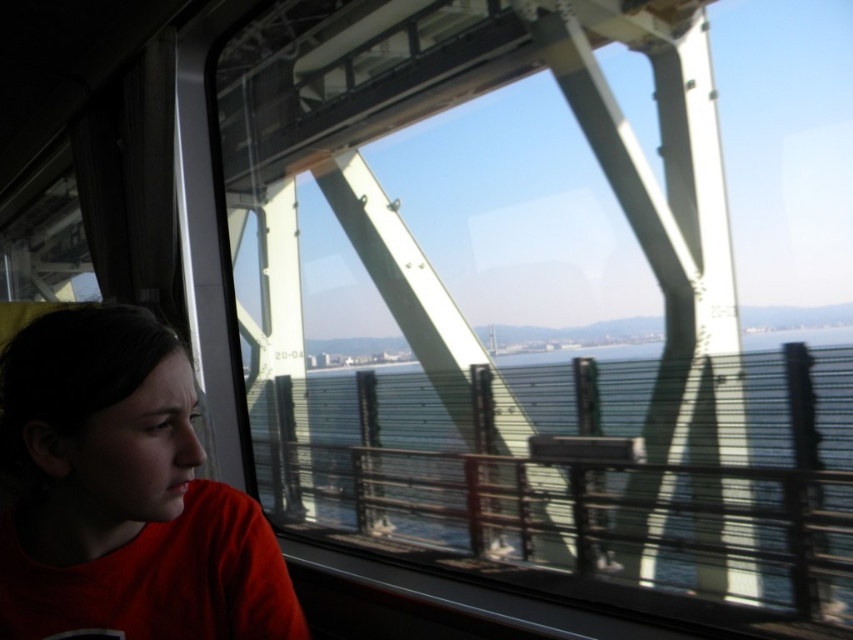
You are a passenger in the cable car and want to touch both the clear glass water at center and the matte red shirt at left. Which object is closer to your hand when you reach out?

The matte red shirt at left is closer to your hand than the clear glass water at center, as it is only 1.37 meters away from the matte red shirt at left.

You are inside a cable car and want to know which of the two points, point [688,586] or point [73,573], is closer to you. Based on the scene, can you determine this?

Point [688,586] is further to the viewer than point [73,573], so the closer point to you is point [73,573].